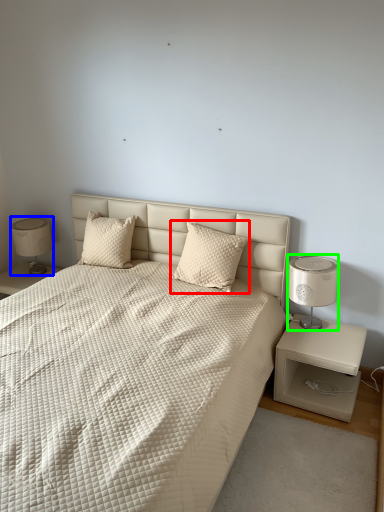
Question: Which object is positioned closest to pillow (highlighted by a red box)? Select from table lamp (highlighted by a blue box) and bedside lamp (highlighted by a green box).

Choices:
 (A) table lamp
 (B) bedside lamp

Answer: (B)